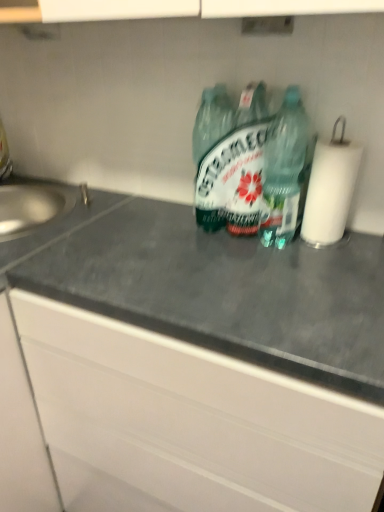
Identify the location of vacant region to the left of green translucent bottle at center, which appears as the second bottle when viewed from the left. Image resolution: width=384 pixels, height=512 pixels. click(x=205, y=251).